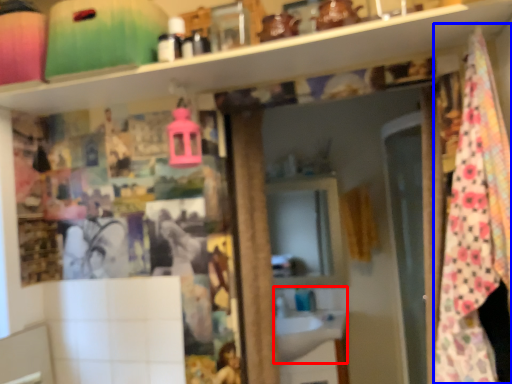
Question: Which object appears closest to the camera in this image, sink (highlighted by a red box) or blanket (highlighted by a blue box)?

Choices:
 (A) sink
 (B) blanket

Answer: (B)